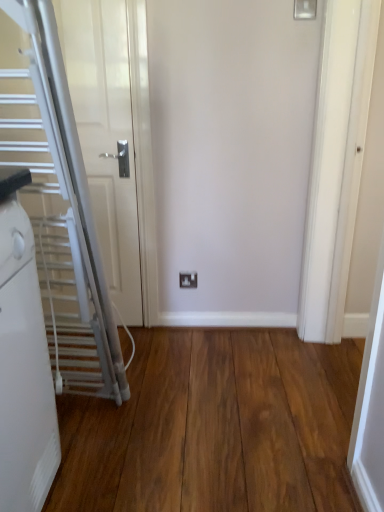
Question: Is the depth of white plastic electric outlet at center less than that of silver metallic escalator at left?

Choices:
 (A) yes
 (B) no

Answer: (B)

Question: From a real-world perspective, is white plastic electric outlet at center positioned over silver metallic escalator at left based on gravity?

Choices:
 (A) yes
 (B) no

Answer: (B)

Question: Does white plastic electric outlet at center have a lesser width compared to silver metallic escalator at left?

Choices:
 (A) yes
 (B) no

Answer: (A)

Question: Is white plastic electric outlet at center smaller than silver metallic escalator at left?

Choices:
 (A) no
 (B) yes

Answer: (B)

Question: Is white plastic electric outlet at center further to camera compared to silver metallic escalator at left?

Choices:
 (A) yes
 (B) no

Answer: (A)

Question: Is white plastic electric outlet at center oriented towards silver metallic escalator at left?

Choices:
 (A) yes
 (B) no

Answer: (B)

Question: Considering the relative positions of silver metallic escalator at left and wooden floor at center in the image provided, is silver metallic escalator at left to the right of wooden floor at center from the viewer's perspective?

Choices:
 (A) no
 (B) yes

Answer: (A)

Question: Is silver metallic escalator at left further to camera compared to wooden floor at center?

Choices:
 (A) no
 (B) yes

Answer: (B)

Question: From the image's perspective, is silver metallic escalator at left under wooden floor at center?

Choices:
 (A) yes
 (B) no

Answer: (B)

Question: Could you tell me if silver metallic escalator at left is facing wooden floor at center?

Choices:
 (A) yes
 (B) no

Answer: (B)

Question: Does silver metallic escalator at left have a greater width compared to wooden floor at center?

Choices:
 (A) no
 (B) yes

Answer: (A)

Question: Is the depth of silver metallic escalator at left less than that of wooden floor at center?

Choices:
 (A) no
 (B) yes

Answer: (A)

Question: Does wooden floor at center have a greater height compared to white plastic electric outlet at center?

Choices:
 (A) no
 (B) yes

Answer: (A)